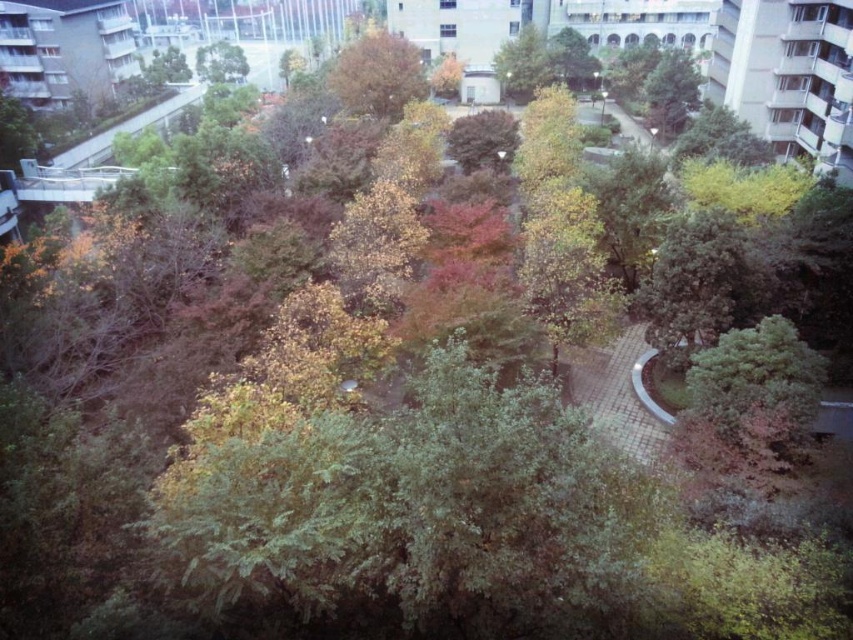
You are standing at the point labeled as point (x=376, y=76) in the park. What type of tree are you touching?

The point (x=376, y=76) is on a brown textured tree at center, so you are touching a brown textured tree at center.

You are a city planner evaluating the park layout. You need to install a new lamppost that must be placed between the brown textured tree at center and the green leafy tree at upper center. Considering their heights, which tree should the lamppost be positioned closer to to ensure adequate lighting without blocking the view of the taller tree?

The brown textured tree at center is taller than the green leafy tree at upper center. To avoid blocking the view of the taller tree and ensure proper lighting, the lamppost should be positioned closer to the shorter green leafy tree at upper center.

You are a park visitor standing on the paved pathway. You want to take a photo of the brown textured tree at center and the green leafy tree at upper center. Which tree should you focus on first to ensure both are in the frame?

You should focus on the brown textured tree at center first because it is closer to you than the green leafy tree at upper center, ensuring both are in the frame.